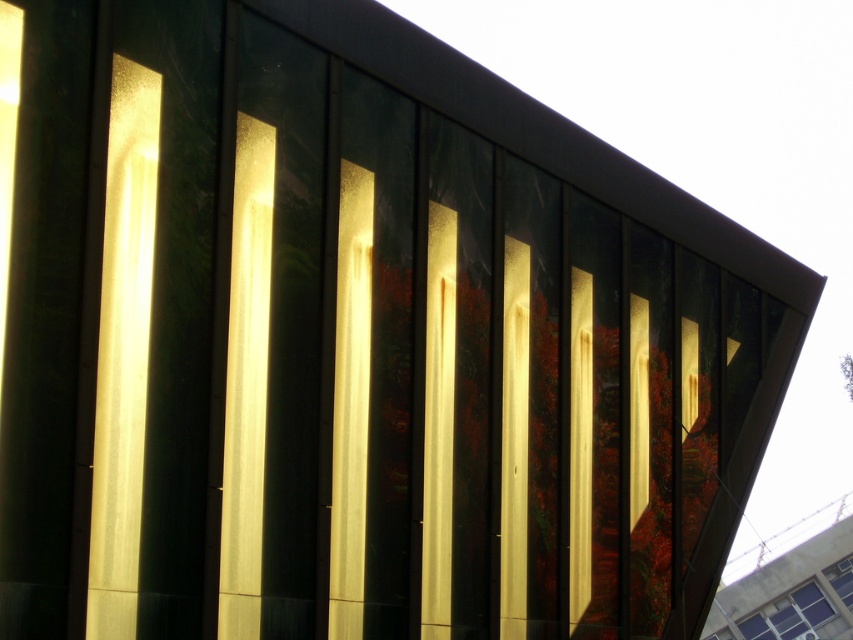
Question: Which point appears closest to the camera in this image?

Choices:
 (A) (782, 620)
 (B) (850, 572)

Answer: (B)

Question: Is clear glass window at lower right positioned behind transparent glass window at lower right?

Choices:
 (A) no
 (B) yes

Answer: (A)

Question: Can you confirm if clear glass window at lower right is positioned below transparent glass window at lower right?

Choices:
 (A) yes
 (B) no

Answer: (A)

Question: Which point is farther to the camera?

Choices:
 (A) transparent glass window at lower right
 (B) clear glass window at lower right

Answer: (A)

Question: Can you confirm if clear glass window at lower right is positioned above transparent glass window at lower right?

Choices:
 (A) yes
 (B) no

Answer: (B)

Question: Which of the following is the closest to the observer?

Choices:
 (A) (846, 600)
 (B) (761, 628)

Answer: (A)